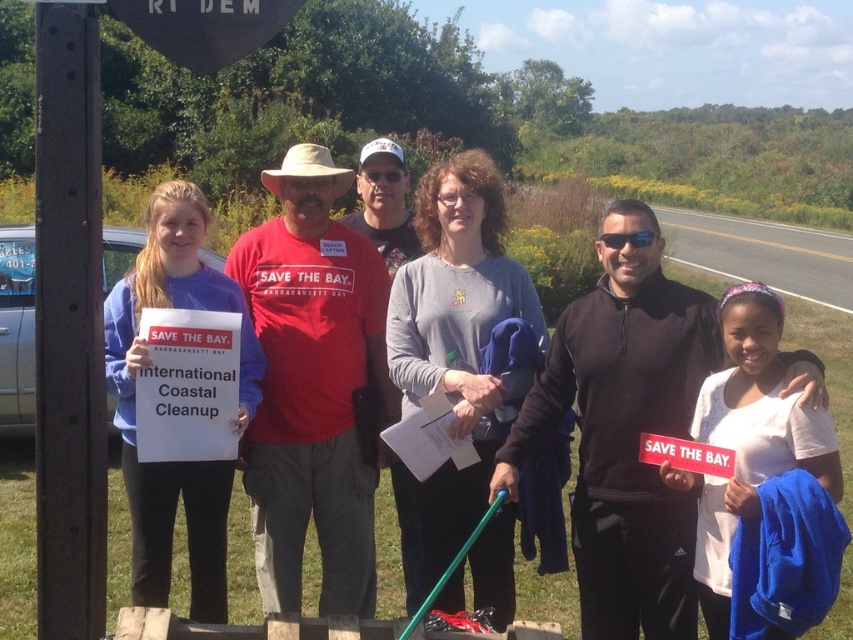
You are a photographer trying to capture a clear photo of both the black matte jacket at center and the gray cotton shirt at center. Based on their positions, which one should you focus on first to ensure both are in sharp focus?

Since the black matte jacket at center is closer to the viewer than the gray cotton shirt at center, you should focus on the black matte jacket at center first. This way, the gray cotton shirt at center will also be in focus as it is further back.